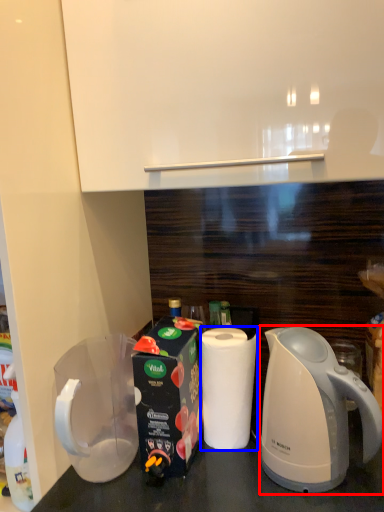
Question: Which object appears closest to the camera in this image, kettle (highlighted by a red box) or paper towel (highlighted by a blue box)?

Choices:
 (A) kettle
 (B) paper towel

Answer: (A)